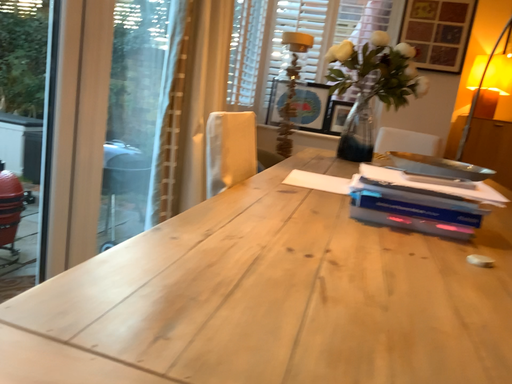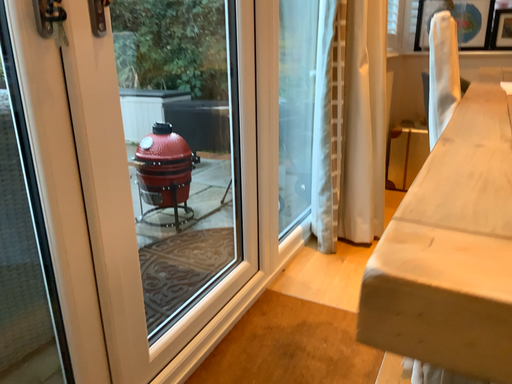
Question: How did the camera likely rotate when shooting the video?

Choices:
 (A) rotated right
 (B) rotated left

Answer: (B)